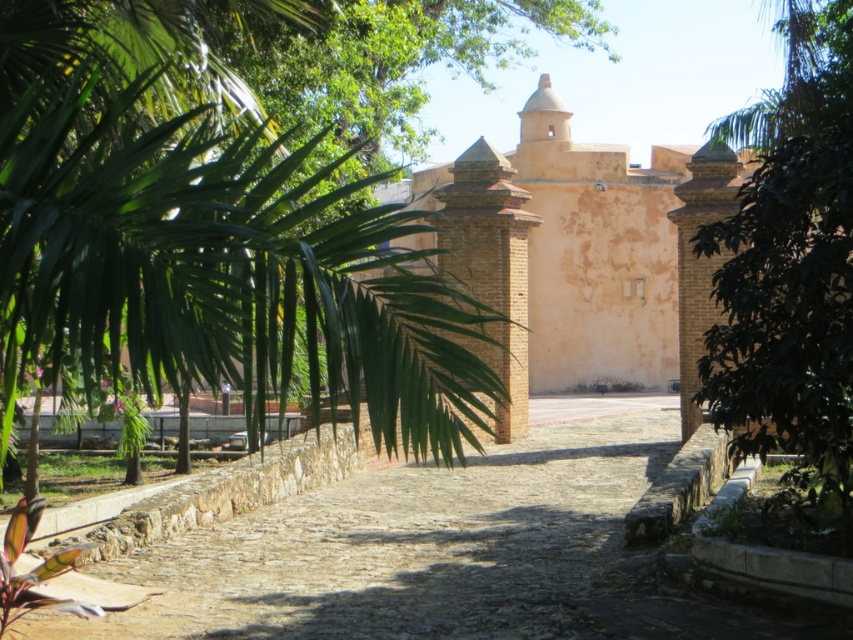
Locate an element on the screen. Image resolution: width=853 pixels, height=640 pixels. brown cobblestone path at center is located at coordinates (405, 547).

Identify the location of brown cobblestone path at center. This screenshot has width=853, height=640. pos(405,547).

Does green leafy tree at center appear over light brown brick church at center?

No.

What do you see at coordinates (790, 269) in the screenshot? I see `green leafy tree at center` at bounding box center [790, 269].

Which is behind, point (776, 278) or point (624, 204)?

The point (624, 204) is behind.

Locate an element on the screen. The image size is (853, 640). green leafy tree at center is located at coordinates (790, 269).

Which is behind, point (260, 554) or point (851, 134)?

Positioned behind is point (260, 554).

Does brown cobblestone path at center have a greater width compared to green leafy tree at center?

Indeed, brown cobblestone path at center has a greater width compared to green leafy tree at center.

Who is more distant from viewer, (350, 582) or (848, 177)?

The point (350, 582) is behind.

Image resolution: width=853 pixels, height=640 pixels. In order to click on brown cobblestone path at center in this screenshot , I will do `click(405, 547)`.